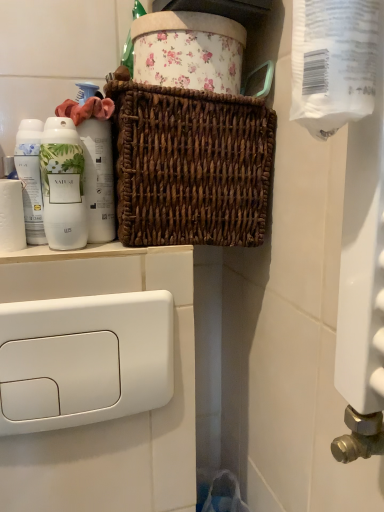
Question: Is white matte bottle at left turned away from white glossy bottle at left?

Choices:
 (A) yes
 (B) no

Answer: (B)

Question: Considering the relative sizes of white matte bottle at left and white glossy bottle at left in the image provided, is white matte bottle at left shorter than white glossy bottle at left?

Choices:
 (A) yes
 (B) no

Answer: (A)

Question: Does white matte bottle at left have a lesser width compared to white glossy bottle at left?

Choices:
 (A) no
 (B) yes

Answer: (B)

Question: Does white matte bottle at left have a greater height compared to white glossy bottle at left?

Choices:
 (A) yes
 (B) no

Answer: (B)

Question: Could you tell me if white matte bottle at left is facing white glossy bottle at left?

Choices:
 (A) no
 (B) yes

Answer: (A)

Question: Which is correct: white glossy mouthwash at left is inside transparent plastic toilet paper at upper right, which appears as the 2th toilet paper when viewed from the left, or outside of it?

Choices:
 (A) inside
 (B) outside

Answer: (B)

Question: Visually, is white glossy mouthwash at left positioned to the left or to the right of transparent plastic toilet paper at upper right, which appears as the 2th toilet paper when viewed from the left?

Choices:
 (A) left
 (B) right

Answer: (A)

Question: Is white glossy mouthwash at left taller or shorter than transparent plastic toilet paper at upper right, which appears as the 2th toilet paper when viewed from the left?

Choices:
 (A) short
 (B) tall

Answer: (A)

Question: From a real-world perspective, relative to transparent plastic toilet paper at upper right, placed as the first toilet paper when sorted from right to left, is white glossy mouthwash at left vertically above or below?

Choices:
 (A) below
 (B) above

Answer: (A)

Question: In the image, is brown woven basket at center positioned in front of or behind white matte toilet paper at left, the 1th toilet paper viewed from the back?

Choices:
 (A) behind
 (B) front

Answer: (B)

Question: Is point (155, 172) positioned closer to the camera than point (11, 185)?

Choices:
 (A) farther
 (B) closer

Answer: (B)

Question: Is brown woven basket at center inside the boundaries of white matte toilet paper at left, the 1th toilet paper viewed from the back, or outside?

Choices:
 (A) inside
 (B) outside

Answer: (B)

Question: Considering the positions of brown woven basket at center and white matte toilet paper at left, the 1th toilet paper viewed from the back, in the image, is brown woven basket at center wider or thinner than white matte toilet paper at left, the 1th toilet paper viewed from the back,?

Choices:
 (A) thin
 (B) wide

Answer: (B)

Question: From the image's perspective, relative to white matte bottle at left, is brown woven basket at center above or below?

Choices:
 (A) above
 (B) below

Answer: (A)

Question: Considering the positions of point (135, 200) and point (72, 232), is point (135, 200) closer or farther from the camera than point (72, 232)?

Choices:
 (A) closer
 (B) farther

Answer: (B)